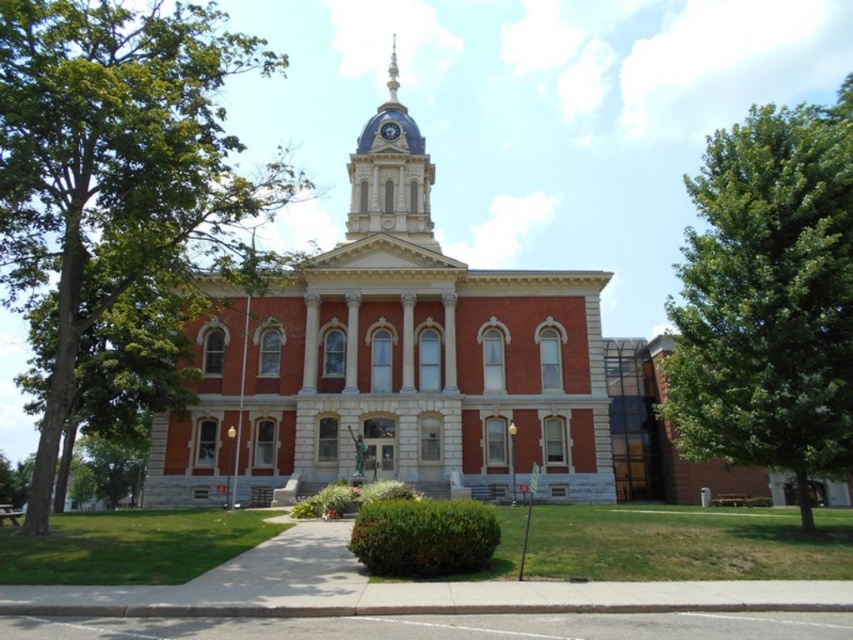
Is green leafy tree at right positioned at the back of shiny silver spire at upper center?

No, it is in front of shiny silver spire at upper center.

Does point (675, 342) lie in front of point (395, 61)?

Yes.

Find the location of a particular element. The image size is (853, 640). green leafy tree at right is located at coordinates (769, 298).

Is point (407, 211) farther from viewer compared to point (379, 230)?

That is True.

Which is more to the left, brick building at center or blue domed clock tower at upper center?

From the viewer's perspective, blue domed clock tower at upper center appears more on the left side.

The image size is (853, 640). Identify the location of brick building at center. (393, 364).

Can you confirm if green leafy tree at left is thinner than blue domed clock tower at upper center?

In fact, green leafy tree at left might be wider than blue domed clock tower at upper center.

From the picture: Who is lower down, green leafy tree at left or blue domed clock tower at upper center?

Positioned lower is green leafy tree at left.

Which is behind, point (120, 61) or point (367, 193)?

The point (367, 193) is behind.

The height and width of the screenshot is (640, 853). Identify the location of green leafy tree at left. (115, 168).